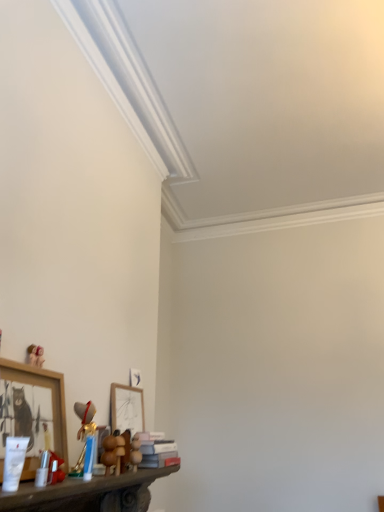
Looking at this image, in order to face wooden picture frame at lower left, which is the second picture frame from right to left, should I rotate leftwards or rightwards?

Rotate left and turn 20.593 degrees.

Identify the location of wooden picture frame at lower left, which is the second picture frame from right to left. The width and height of the screenshot is (384, 512). (51, 397).

Find the location of a particular element. This screenshot has width=384, height=512. brown plush bear at lower center, the third toy viewed from the front is located at coordinates (135, 452).

What is the approximate width of wooden carved shelf at lower left?

wooden carved shelf at lower left is 9.89 inches wide.

Image resolution: width=384 pixels, height=512 pixels. Describe the element at coordinates (87, 494) in the screenshot. I see `wooden carved shelf at lower left` at that location.

This screenshot has width=384, height=512. What are the coordinates of `matte pink teddy bear at lower left, which ranks as the 3th toy in bottom-to-top order` in the screenshot? It's located at (35, 355).

Image resolution: width=384 pixels, height=512 pixels. What do you see at coordinates (35, 355) in the screenshot?
I see `matte pink teddy bear at lower left, the second toy viewed from the back` at bounding box center [35, 355].

At what (x,y) coordinates should I click in order to perform the action: click on wooden picture frame at lower left, marked as the first picture frame in a front-to-back arrangement. Please return your answer as a coordinate pair (x, y). This screenshot has height=512, width=384. Looking at the image, I should click on (x=51, y=397).

Is brown plush bear at lower center, positioned as the 1th toy in right-to-left order, to the right of wooden bear at lower center, marked as the first toy in a front-to-back arrangement, from the viewer's perspective?

Correct, you'll find brown plush bear at lower center, positioned as the 1th toy in right-to-left order, to the right of wooden bear at lower center, marked as the first toy in a front-to-back arrangement.

Is brown plush bear at lower center, marked as the 3th toy in a top-to-bottom arrangement, next to wooden bear at lower center, the 2th toy in the top-to-bottom sequence?

No, brown plush bear at lower center, marked as the 3th toy in a top-to-bottom arrangement, is not in contact with wooden bear at lower center, the 2th toy in the top-to-bottom sequence.

From the image's perspective, is brown plush bear at lower center, which is counted as the first toy, starting from the back, positioned above or below wooden bear at lower center, which is the 3th toy in back-to-front order?

brown plush bear at lower center, which is counted as the first toy, starting from the back, is situated lower than wooden bear at lower center, which is the 3th toy in back-to-front order, in the image.

Which is behind, brown plush bear at lower center, which is counted as the first toy, starting from the back, or wooden bear at lower center, acting as the 2th toy starting from the right?

brown plush bear at lower center, which is counted as the first toy, starting from the back, is further away from the camera.

From the image's perspective, which object appears higher, wooden picture frame at lower left, arranged as the 2th picture frame when viewed from the back, or matte pink book at lower center?

wooden picture frame at lower left, arranged as the 2th picture frame when viewed from the back, appears higher in the image.

From a real-world perspective, is wooden picture frame at lower left, which is the second picture frame from right to left, located beneath matte pink book at lower center?

No, from a real-world perspective, wooden picture frame at lower left, which is the second picture frame from right to left, is not beneath matte pink book at lower center.

Considering the relative sizes of wooden picture frame at lower left, which is the second picture frame from right to left, and matte pink book at lower center in the image provided, is wooden picture frame at lower left, which is the second picture frame from right to left, smaller than matte pink book at lower center?

Actually, wooden picture frame at lower left, which is the second picture frame from right to left, might be larger than matte pink book at lower center.

Is wooden picture frame at lower left, arranged as the 2th picture frame when viewed from the back, in front of or behind matte pink book at lower center in the image?

Visually, wooden picture frame at lower left, arranged as the 2th picture frame when viewed from the back, is located in front of matte pink book at lower center.

Considering the positions of objects matte pink book at lower center and wooden bear at lower center, acting as the 2th toy starting from the right, in the image provided, who is more to the right, matte pink book at lower center or wooden bear at lower center, acting as the 2th toy starting from the right,?

matte pink book at lower center.

Is wooden bear at lower center, the second toy ordered from the bottom, at the back of matte pink book at lower center?

matte pink book at lower center is not turned away from wooden bear at lower center, the second toy ordered from the bottom.

Which object is more forward, matte pink book at lower center or wooden bear at lower center, which is the 3th toy in back-to-front order?

Positioned in front is wooden bear at lower center, which is the 3th toy in back-to-front order.

Between point (136, 402) and point (133, 461), which one is positioned behind?

Positioned behind is point (136, 402).

Is matte white picture frame at center, placed as the 2th picture frame when sorted from left to right, not near matte pink book at lower center?

No, matte white picture frame at center, placed as the 2th picture frame when sorted from left to right, is not far away from matte pink book at lower center.

Between matte white picture frame at center, placed as the 2th picture frame when sorted from left to right, and matte pink book at lower center, which one has less height?

Standing shorter between the two is matte pink book at lower center.

From the image's perspective, is matte white picture frame at center, which is the first picture frame from right to left, located above or below matte pink book at lower center?

Based on their image positions, matte white picture frame at center, which is the first picture frame from right to left, is located above matte pink book at lower center.

Between wooden bear at lower center, which is the 3th toy in back-to-front order, and matte pink book at lower center, which one has smaller size?

With smaller size is wooden bear at lower center, which is the 3th toy in back-to-front order.

Can you tell me how much wooden bear at lower center, which is the 3th toy in back-to-front order, and matte pink book at lower center differ in facing direction?

There is a 0.396-degree angle between the facing directions of wooden bear at lower center, which is the 3th toy in back-to-front order, and matte pink book at lower center.

The width and height of the screenshot is (384, 512). In order to click on book lying below the wooden bear at lower center, acting as the 2th toy starting from the right (from the image's perspective) in this screenshot , I will do `click(153, 450)`.

Identify the location of the 1st toy positioned below the matte pink teddy bear at lower left, which ranks as the 3th toy in bottom-to-top order (from a real-world perspective). This screenshot has height=512, width=384. (135, 452).

Is brown plush bear at lower center, positioned as the 1th toy in right-to-left order, oriented away from matte pink teddy bear at lower left, which ranks as the 3th toy in bottom-to-top order?

No, brown plush bear at lower center, positioned as the 1th toy in right-to-left order, is not facing away from matte pink teddy bear at lower left, which ranks as the 3th toy in bottom-to-top order.

Is the depth of brown plush bear at lower center, positioned as the 1th toy in right-to-left order, greater than that of matte pink teddy bear at lower left, which ranks as the 3th toy in bottom-to-top order?

Yes, brown plush bear at lower center, positioned as the 1th toy in right-to-left order, is behind matte pink teddy bear at lower left, which ranks as the 3th toy in bottom-to-top order.

From the image's perspective, does brown plush bear at lower center, the third toy from the left, appear lower than matte pink teddy bear at lower left, which is the 1th toy in left-to-right order?

Yes, from the image's perspective, brown plush bear at lower center, the third toy from the left, is below matte pink teddy bear at lower left, which is the 1th toy in left-to-right order.

How much distance is there between wooden carved shelf at lower left and matte pink book at lower center?

wooden carved shelf at lower left and matte pink book at lower center are 7.27 inches apart.

Would you say wooden carved shelf at lower left is inside or outside matte pink book at lower center?

The correct answer is: outside.

Is wooden carved shelf at lower left far from matte pink book at lower center?

Actually, wooden carved shelf at lower left and matte pink book at lower center are a little close together.

Consider the image. Which of these two, wooden carved shelf at lower left or matte pink book at lower center, is bigger?

Bigger between the two is wooden carved shelf at lower left.

The width and height of the screenshot is (384, 512). What are the coordinates of `toy below the brown plush bear at lower center, the third toy from the left (from a real-world perspective)` in the screenshot? It's located at (109, 452).

From a real-world perspective, starting from the matte pink book at lower center, which picture frame is the 1st one vertically above it? Please provide its 2D coordinates.

[(51, 397)]

Looking at the image, which one is located further to matte white picture frame at center, which is the first picture frame from right to left, matte pink book at lower center or brown plush bear at lower center, marked as the 3th toy in a top-to-bottom arrangement?

Based on the image, brown plush bear at lower center, marked as the 3th toy in a top-to-bottom arrangement, appears to be further to matte white picture frame at center, which is the first picture frame from right to left.

Estimate the real-world distances between objects in this image. Which object is further from matte white picture frame at center, the 1th picture frame viewed from the back, matte pink teddy bear at lower left, marked as the first toy in a top-to-bottom arrangement, or wooden bear at lower center, the second toy ordered from the bottom?

matte pink teddy bear at lower left, marked as the first toy in a top-to-bottom arrangement, is positioned further to the anchor matte white picture frame at center, the 1th picture frame viewed from the back.

Which object lies further to the anchor point matte white picture frame at center, the 2th picture frame in the front-to-back sequence, matte pink teddy bear at lower left, the second toy from the front, or wooden carved shelf at lower left?

matte pink teddy bear at lower left, the second toy from the front, lies further to matte white picture frame at center, the 2th picture frame in the front-to-back sequence, than the other object.

From the image, which object appears to be nearer to wooden carved shelf at lower left, matte white picture frame at center, placed as the 2th picture frame when sorted from left to right, or brown plush bear at lower center, which is counted as the first toy, starting from the back?

The object closer to wooden carved shelf at lower left is brown plush bear at lower center, which is counted as the first toy, starting from the back.

From the image, which object appears to be farther from wooden bear at lower center, the 2th toy in the top-to-bottom sequence, matte pink teddy bear at lower left, marked as the first toy in a top-to-bottom arrangement, or matte pink book at lower center?

matte pink teddy bear at lower left, marked as the first toy in a top-to-bottom arrangement, lies further to wooden bear at lower center, the 2th toy in the top-to-bottom sequence, than the other object.

Based on their spatial positions, is matte pink teddy bear at lower left, the 3th toy from the right, or matte white picture frame at center, placed as the 2th picture frame when sorted from left to right, further from wooden carved shelf at lower left?

Based on the image, matte pink teddy bear at lower left, the 3th toy from the right, appears to be further to wooden carved shelf at lower left.

Estimate the real-world distances between objects in this image. Which object is further from matte pink teddy bear at lower left, marked as the first toy in a top-to-bottom arrangement, brown plush bear at lower center, which is the first toy from bottom to top, or matte pink book at lower center?

matte pink book at lower center lies further to matte pink teddy bear at lower left, marked as the first toy in a top-to-bottom arrangement, than the other object.

Estimate the real-world distances between objects in this image. Which object is further from wooden picture frame at lower left, marked as the first picture frame in a front-to-back arrangement, matte pink book at lower center or matte white picture frame at center, placed as the 2th picture frame when sorted from left to right?

Among the two, matte white picture frame at center, placed as the 2th picture frame when sorted from left to right, is located further to wooden picture frame at lower left, marked as the first picture frame in a front-to-back arrangement.

The width and height of the screenshot is (384, 512). I want to click on toy located between wooden carved shelf at lower left and matte pink teddy bear at lower left, marked as the first toy in a top-to-bottom arrangement, in the depth direction, so click(109, 452).

Find the location of a particular element. The height and width of the screenshot is (512, 384). book between wooden bear at lower center, the 2th toy in the top-to-bottom sequence, and matte white picture frame at center, the 1th picture frame viewed from the back, in the front-back direction is located at coordinates (153, 450).

Identify the location of picture frame between wooden carved shelf at lower left and matte pink book at lower center in the front-back direction. The image size is (384, 512). (51, 397).

Locate an element on the screen. book between wooden carved shelf at lower left and matte white picture frame at center, placed as the 2th picture frame when sorted from left to right, from front to back is located at coordinates (153, 450).